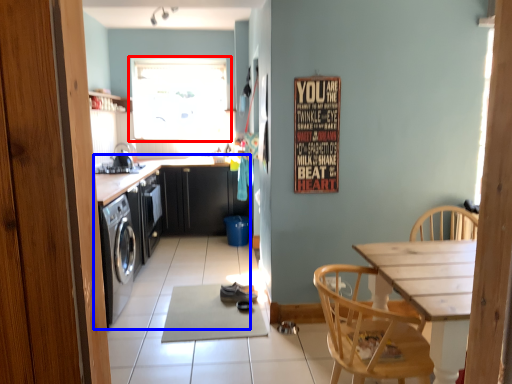
Question: Which of the following is the farthest to the observer, window (highlighted by a red box) or cabinetry (highlighted by a blue box)?

Choices:
 (A) window
 (B) cabinetry

Answer: (A)